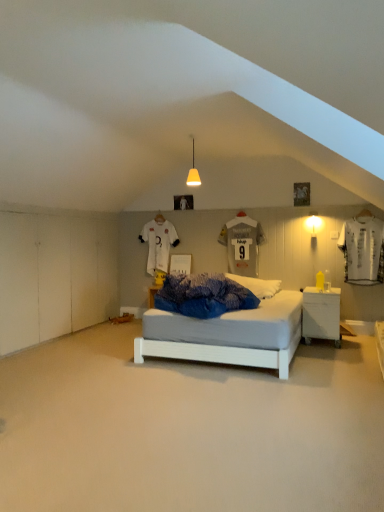
Question: Which is correct: white matte wall sconce at right, acting as the first light fixture starting from the bottom, is inside white smooth floor at center, or outside of it?

Choices:
 (A) outside
 (B) inside

Answer: (A)

Question: Does point (314, 246) appear closer or farther from the camera than point (82, 438)?

Choices:
 (A) farther
 (B) closer

Answer: (A)

Question: Considering the real-world distances, which object is closest to the white glossy nightstand at lower right?

Choices:
 (A) matte yellow pendant at center, positioned as the 2th light fixture in back-to-front order
 (B) white jersey at upper center, the 2th t shirt when ordered from front to back
 (C) gray matte jersey at center, which is the 2th t shirt in left-to-right order
 (D) white soft pillow at center
 (E) white smooth floor at center

Answer: (D)

Question: Estimate the real-world distances between objects in this image. Which object is farther from the white smooth floor at center?

Choices:
 (A) white soft pillow at center
 (B) white matte wall sconce at right, which ranks as the second light fixture in top-to-bottom order
 (C) white jersey at upper center, the 2th t shirt when ordered from front to back
 (D) matte yellow pendant at center, the first light fixture from the top
 (E) white glossy nightstand at lower right

Answer: (D)